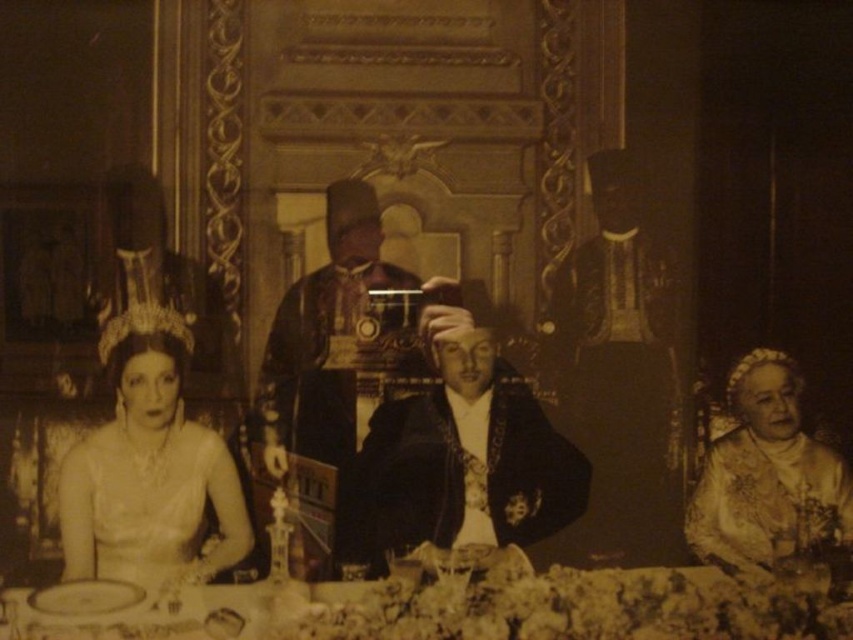
Question: Which is nearer to the shiny black coat at center?

Choices:
 (A) white satin dress at left
 (B) smooth leather jacket at center

Answer: (A)

Question: Can you confirm if white lace tablecloth at lower center is positioned below gold embroidered dress at center?

Choices:
 (A) yes
 (B) no

Answer: (A)

Question: Which of the following is the farthest from the observer?

Choices:
 (A) (740, 448)
 (B) (350, 508)
 (C) (167, 563)
 (D) (131, 264)

Answer: (A)

Question: Does white satin dress at left lie in front of gold embroidered dress at center?

Choices:
 (A) yes
 (B) no

Answer: (A)

Question: Does smooth leather jacket at center have a greater width compared to white lace tiara at upper left?

Choices:
 (A) no
 (B) yes

Answer: (B)

Question: Which object is closer to the camera taking this photo?

Choices:
 (A) smooth leather jacket at center
 (B) white lace tiara at upper left

Answer: (A)